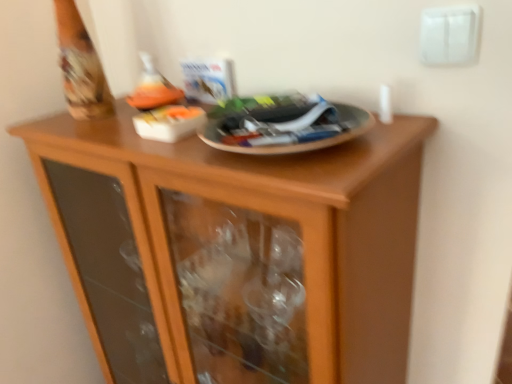
Question: Is matte orange wine bottle at upper center wider than white plastic electric outlet at upper right?

Choices:
 (A) no
 (B) yes

Answer: (B)

Question: Does matte orange wine bottle at upper center come behind white plastic electric outlet at upper right?

Choices:
 (A) no
 (B) yes

Answer: (B)

Question: Considering the relative sizes of matte orange wine bottle at upper center and white plastic electric outlet at upper right in the image provided, is matte orange wine bottle at upper center taller than white plastic electric outlet at upper right?

Choices:
 (A) no
 (B) yes

Answer: (B)

Question: Considering the relative positions of matte orange wine bottle at upper center and white plastic electric outlet at upper right in the image provided, is matte orange wine bottle at upper center to the left of white plastic electric outlet at upper right from the viewer's perspective?

Choices:
 (A) no
 (B) yes

Answer: (B)

Question: Does matte orange wine bottle at upper center appear on the right side of white plastic electric outlet at upper right?

Choices:
 (A) no
 (B) yes

Answer: (A)

Question: Is white plastic electric outlet at upper right spatially inside matte orange wine bottle at upper center, or outside of it?

Choices:
 (A) outside
 (B) inside

Answer: (A)

Question: From the image's perspective, relative to matte orange wine bottle at upper center, is white plastic electric outlet at upper right above or below?

Choices:
 (A) above
 (B) below

Answer: (A)

Question: From a real-world perspective, is white plastic electric outlet at upper right positioned above or below matte orange wine bottle at upper center?

Choices:
 (A) above
 (B) below

Answer: (A)

Question: Does point (422, 61) appear closer or farther from the camera than point (180, 89)?

Choices:
 (A) farther
 (B) closer

Answer: (B)

Question: In terms of height, does white plastic electric outlet at upper right look taller or shorter compared to wooden cabinet at center?

Choices:
 (A) short
 (B) tall

Answer: (A)

Question: Is white plastic electric outlet at upper right spatially inside wooden cabinet at center, or outside of it?

Choices:
 (A) inside
 (B) outside

Answer: (B)

Question: From the image's perspective, is white plastic electric outlet at upper right positioned above or below wooden cabinet at center?

Choices:
 (A) above
 (B) below

Answer: (A)

Question: Is point (461, 18) positioned closer to the camera than point (337, 269)?

Choices:
 (A) closer
 (B) farther

Answer: (B)

Question: Considering the positions of matte orange wine bottle at upper center and white plastic electric outlet at upper right in the image, is matte orange wine bottle at upper center bigger or smaller than white plastic electric outlet at upper right?

Choices:
 (A) small
 (B) big

Answer: (B)

Question: In terms of width, does matte orange wine bottle at upper center look wider or thinner when compared to white plastic electric outlet at upper right?

Choices:
 (A) wide
 (B) thin

Answer: (A)